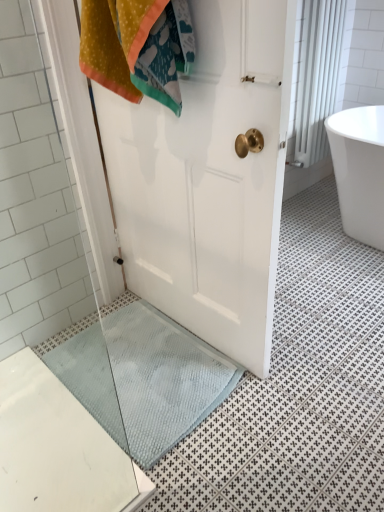
You are a GUI agent. You are given a task and a screenshot of the screen. Output one action in this format:
    pyautogui.click(x=<x>, y=<y>)
    Task: Click on the light blue textured bath mat at lower center
    The width and height of the screenshot is (384, 512).
    Given the screenshot: What is the action you would take?
    pyautogui.click(x=142, y=379)

The height and width of the screenshot is (512, 384). Describe the element at coordinates (359, 170) in the screenshot. I see `white glossy bathtub at right` at that location.

Locate an element on the screen. This screenshot has height=512, width=384. light blue textured bath mat at lower center is located at coordinates (142, 379).

In the scene shown: From the image's perspective, between white glossy bathtub at right and white textured curtain at upper right, which one is located above?

white textured curtain at upper right is shown above in the image.

Measure the distance between white glossy bathtub at right and white textured curtain at upper right.

white glossy bathtub at right is 15.96 inches away from white textured curtain at upper right.

At what (x,y) coordinates should I click in order to perform the action: click on shower curtain above the white glossy bathtub at right (from the image's perspective). Please return your answer as a coordinate pair (x, y). The image size is (384, 512). Looking at the image, I should click on (317, 76).

Is white glossy bathtub at right surrounding white textured curtain at upper right?

No, white textured curtain at upper right is located outside of white glossy bathtub at right.

In the scene shown: Based on their positions, is white textured curtain at upper right located to the left or right of white glossy bathtub at right?

From the image, it's evident that white textured curtain at upper right is to the left of white glossy bathtub at right.

Is white textured curtain at upper right in front of white glossy bathtub at right?

No, white textured curtain at upper right is further to the viewer.

Considering the relative sizes of white textured curtain at upper right and white glossy bathtub at right in the image provided, is white textured curtain at upper right thinner than white glossy bathtub at right?

Yes, white textured curtain at upper right is thinner than white glossy bathtub at right.

Which is correct: white textured curtain at upper right is inside white glossy bathtub at right, or outside of it?

Answer: white textured curtain at upper right is located beyond the bounds of white glossy bathtub at right.

Who is more distant, white glossy bathtub at right or light blue textured bath mat at lower center?

white glossy bathtub at right is behind.

How many degrees apart are the facing directions of white glossy bathtub at right and light blue textured bath mat at lower center?

There is a 91.2-degree angle between the facing directions of white glossy bathtub at right and light blue textured bath mat at lower center.

Is white glossy bathtub at right shorter than light blue textured bath mat at lower center?

No, white glossy bathtub at right is not shorter than light blue textured bath mat at lower center.

From a real-world perspective, is white glossy bathtub at right on light blue textured bath mat at lower center?

Yes, from a real-world perspective, white glossy bathtub at right is above light blue textured bath mat at lower center.

From the image's perspective, which one is positioned lower, light blue textured bath mat at lower center or white textured curtain at upper right?

light blue textured bath mat at lower center appears lower in the image.

Considering the sizes of objects light blue textured bath mat at lower center and white textured curtain at upper right in the image provided, who is thinner, light blue textured bath mat at lower center or white textured curtain at upper right?

With smaller width is white textured curtain at upper right.

Is light blue textured bath mat at lower center not inside white textured curtain at upper right?

Indeed, light blue textured bath mat at lower center is completely outside white textured curtain at upper right.

Image resolution: width=384 pixels, height=512 pixels. I want to click on bath mat that is in front of the white textured curtain at upper right, so click(142, 379).

This screenshot has height=512, width=384. Find the location of `bath mat located in front of the white textured curtain at upper right`. bath mat located in front of the white textured curtain at upper right is located at coordinates (142, 379).

In terms of height, does white textured curtain at upper right look taller or shorter compared to light blue textured bath mat at lower center?

Clearly, white textured curtain at upper right is taller compared to light blue textured bath mat at lower center.

Looking at this image, is white textured curtain at upper right beside light blue textured bath mat at lower center?

white textured curtain at upper right is not next to light blue textured bath mat at lower center, and they're not touching.

Which point is more distant from viewer, (338, 76) or (115, 403)?

The point (338, 76) is behind.

Is light blue textured bath mat at lower center positioned in front of white glossy bathtub at right?

That is True.

Where is `bathtub behind the light blue textured bath mat at lower center`? This screenshot has height=512, width=384. bathtub behind the light blue textured bath mat at lower center is located at coordinates (359, 170).

How many degrees apart are the facing directions of light blue textured bath mat at lower center and white glossy bathtub at right?

The facing directions of light blue textured bath mat at lower center and white glossy bathtub at right are 91.2 degrees apart.

Considering the relative sizes of light blue textured bath mat at lower center and white glossy bathtub at right in the image provided, is light blue textured bath mat at lower center shorter than white glossy bathtub at right?

Yes.

The image size is (384, 512). There is a white glossy bathtub at right. What are the coordinates of `shower curtain above it (from a real-world perspective)` in the screenshot? It's located at (317, 76).

Where is `shower curtain behind the white glossy bathtub at right`? The height and width of the screenshot is (512, 384). shower curtain behind the white glossy bathtub at right is located at coordinates (317, 76).

When comparing their distances from white textured curtain at upper right, does light blue textured bath mat at lower center or white glossy bathtub at right seem closer?

white glossy bathtub at right is positioned closer to the anchor white textured curtain at upper right.

Which object lies nearer to the anchor point light blue textured bath mat at lower center, white textured curtain at upper right or white glossy bathtub at right?

white glossy bathtub at right.

Considering their positions, is light blue textured bath mat at lower center positioned further to white glossy bathtub at right than white textured curtain at upper right?

The object further to white glossy bathtub at right is light blue textured bath mat at lower center.

Which object lies further to the anchor point white glossy bathtub at right, white textured curtain at upper right or light blue textured bath mat at lower center?

The object further to white glossy bathtub at right is light blue textured bath mat at lower center.

Based on their spatial positions, is white glossy bathtub at right or light blue textured bath mat at lower center further from white textured curtain at upper right?

light blue textured bath mat at lower center is further to white textured curtain at upper right.

Which object lies nearer to the anchor point light blue textured bath mat at lower center, white glossy bathtub at right or white textured curtain at upper right?

white glossy bathtub at right is positioned closer to the anchor light blue textured bath mat at lower center.

Image resolution: width=384 pixels, height=512 pixels. What are the coordinates of `bathtub between white textured curtain at upper right and light blue textured bath mat at lower center in the vertical direction` in the screenshot? It's located at (359, 170).